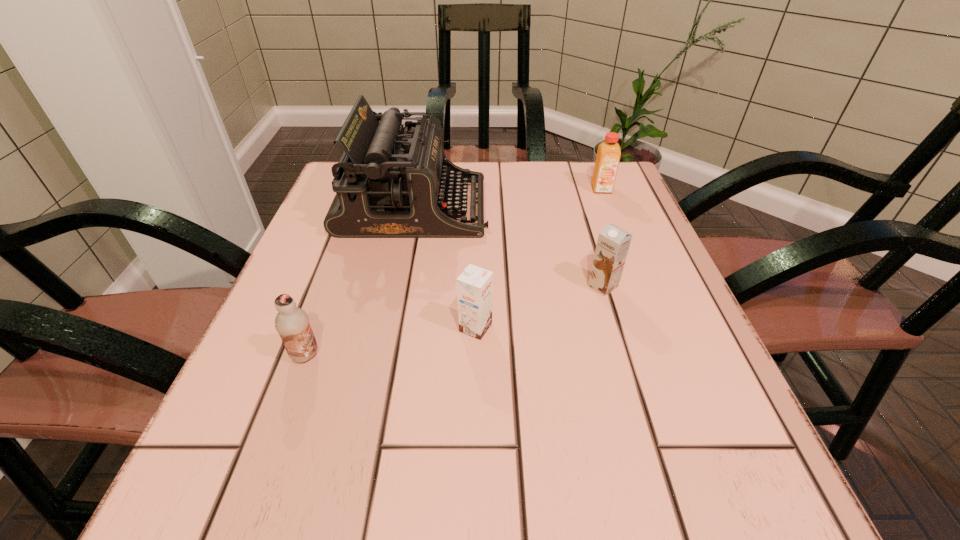
Locate an element on the screen. The image size is (960, 540). blank area located 0.250m on the back of the third nearest object is located at coordinates pyautogui.click(x=578, y=204).

Find the location of a particular element. The width and height of the screenshot is (960, 540). vacant space positioned 0.090m on the back of the nearest object is located at coordinates (324, 305).

Where is `vacant space located 0.310m on the right of the second chocolate milk from right to left`? This screenshot has width=960, height=540. vacant space located 0.310m on the right of the second chocolate milk from right to left is located at coordinates (677, 328).

Where is `typewriter located at the far edge`? Image resolution: width=960 pixels, height=540 pixels. typewriter located at the far edge is located at coordinates (390, 183).

Find the location of a particular element. The image size is (960, 540). orange juice located in the far edge section of the desktop is located at coordinates point(608,155).

You are a GUI agent. You are given a task and a screenshot of the screen. Output one action in this format:
    pyautogui.click(x=<x>, y=<y>)
    Task: Click on the typewriter present at the left edge
    This screenshot has height=540, width=960.
    Given the screenshot: What is the action you would take?
    pyautogui.click(x=390, y=183)

Locate an element on the screen. chocolate milk at the left edge is located at coordinates (292, 323).

Where is `orange juice at the right edge`? The image size is (960, 540). orange juice at the right edge is located at coordinates (608, 155).

Find the location of `chocolate milk at the right edge`. chocolate milk at the right edge is located at coordinates (613, 243).

Where is `object present at the far left corner`? The height and width of the screenshot is (540, 960). object present at the far left corner is located at coordinates (390, 183).